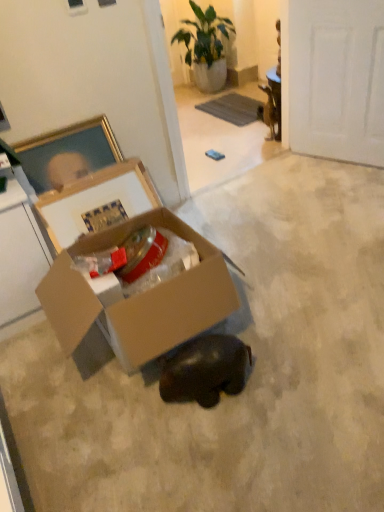
Where is `vacant area that lies between white matte door at upper right and shiny black elephant at center`? The image size is (384, 512). vacant area that lies between white matte door at upper right and shiny black elephant at center is located at coordinates (306, 229).